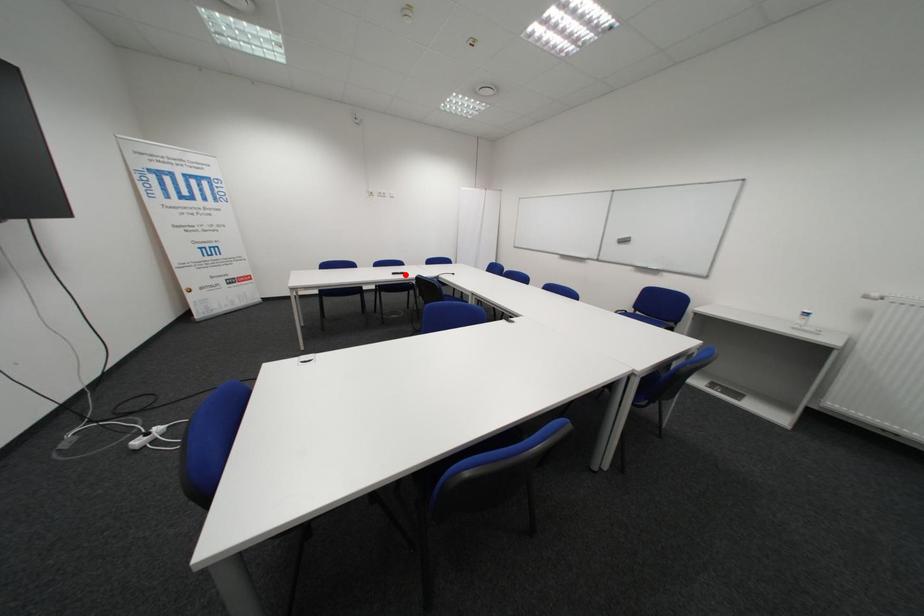
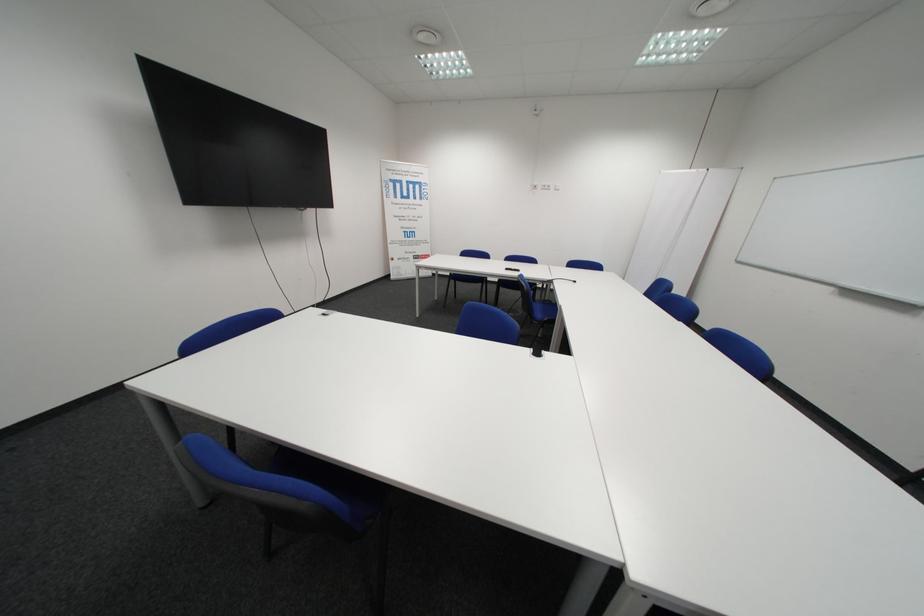
Question: I am providing you with two images of the same scene from different viewpoints. A red point is shown in image1. For the corresponding object point in image2, is it positioned nearer or farther from the camera?

Choices:
 (A) Nearer
 (B) Farther

Answer: (A)